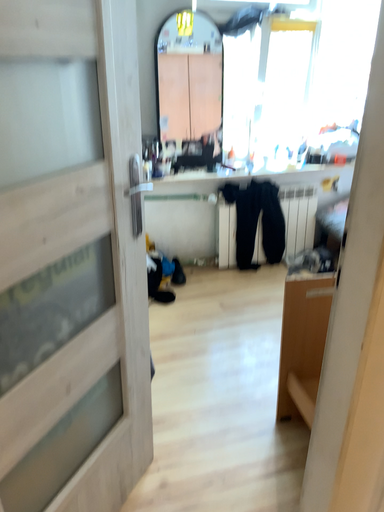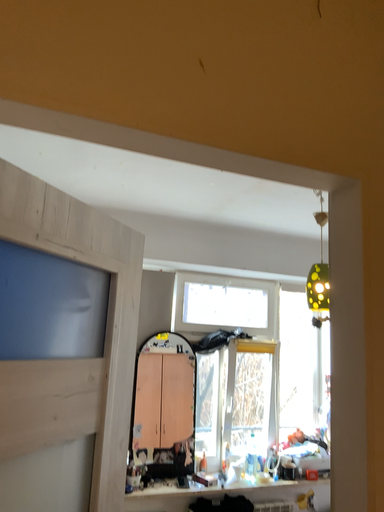
Question: How did the camera likely rotate when shooting the video?

Choices:
 (A) rotated upward
 (B) rotated downward

Answer: (A)